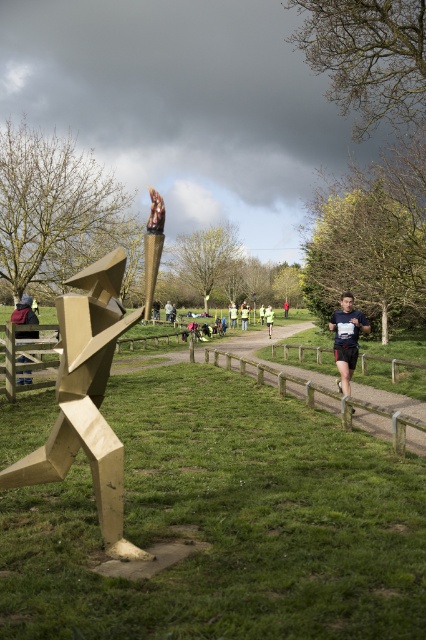
You are a photographer positioned at the end of the path. You want to capture a photo that includes both the gold metallic sculpture at left and the yellow fabric runner at center. Based on their heights, which object should appear smaller in the photo?

The gold metallic sculpture at left is not as tall as the yellow fabric runner at center, so it should appear smaller in the photo.

You are a photographer positioned to capture the scene with the gold metallic sculpture at left and the gold metallic torch at center. Given their sizes, which object would appear closer to the camera in your photo?

The gold metallic sculpture at left appears closer to the camera because it has a larger size compared to the gold metallic torch at center, indicating it is nearer.

You are a participant in the race and are currently at point (160, 225). You need to reach the golden sculpture. Which direction should you move relative to point (117, 256) to get closer to the sculpture?

To reach the golden sculpture, you should move towards point (117, 256) because it is behind point (160, 225), meaning moving towards it would bring you closer to the sculpture.